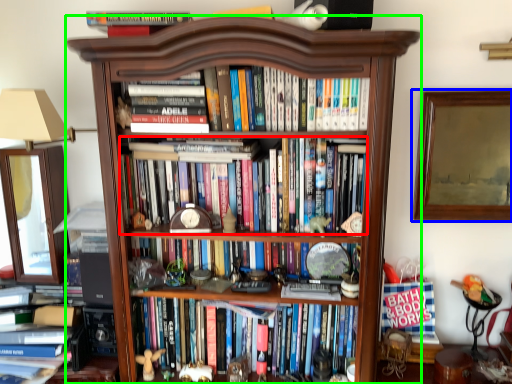
Question: Estimate the real-world distances between objects in this image. Which object is closer to book (highlighted by a red box), picture frame (highlighted by a blue box) or bookcase (highlighted by a green box)?

Choices:
 (A) picture frame
 (B) bookcase

Answer: (B)